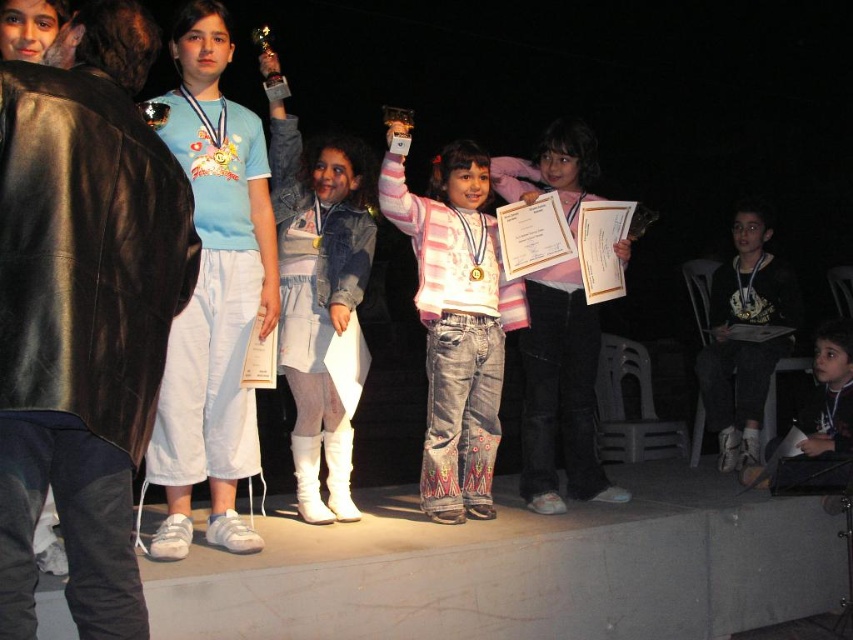
Question: Where is pink striped sweater at center located in relation to black leather jacket at lower right in the image?

Choices:
 (A) above
 (B) below

Answer: (A)

Question: Among these objects, which one is farthest from the camera?

Choices:
 (A) black leather jacket at lower right
 (B) pink striped sweater at center

Answer: (A)

Question: Which object appears farthest from the camera in this image?

Choices:
 (A) pink striped sweater at center
 (B) white leather boots at center

Answer: (A)

Question: Among these objects, which one is nearest to the camera?

Choices:
 (A) white leather boots at center
 (B) black leather jacket at lower right

Answer: (A)

Question: Is white leather boots at center smaller than pink striped sweater at center?

Choices:
 (A) yes
 (B) no

Answer: (A)

Question: Is white leather boots at center wider than black leather jacket at lower right?

Choices:
 (A) yes
 (B) no

Answer: (B)